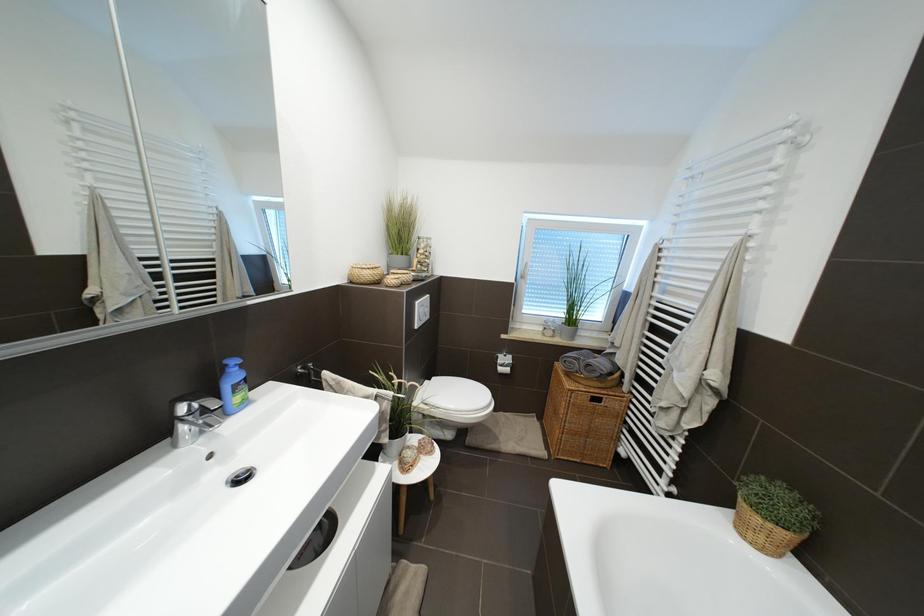
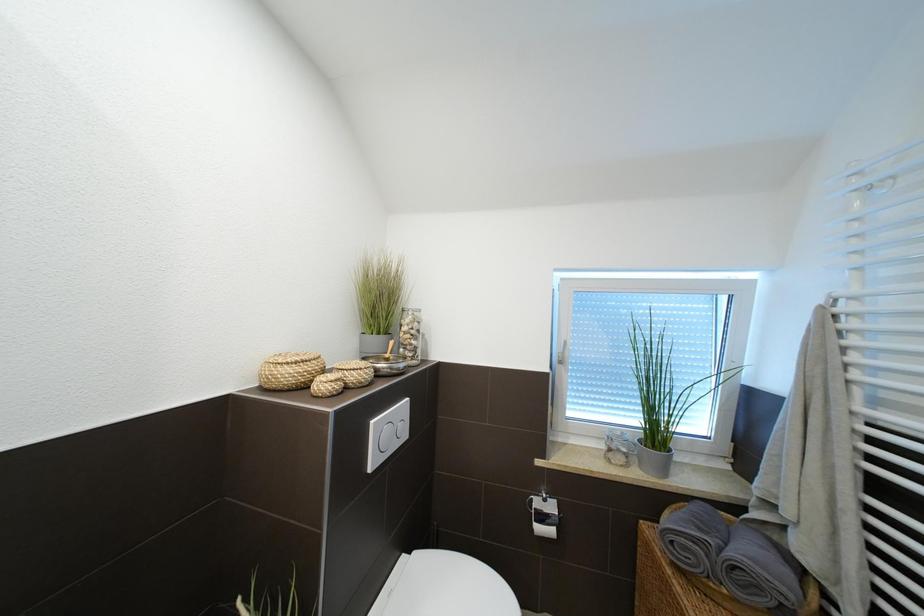
Question: Which direction would the cameraman need to move to produce the second image? Reply with the corresponding letter.

Choices:
 (A) Left
 (B) Right
 (C) Forward
 (D) Backward

Answer: (C)